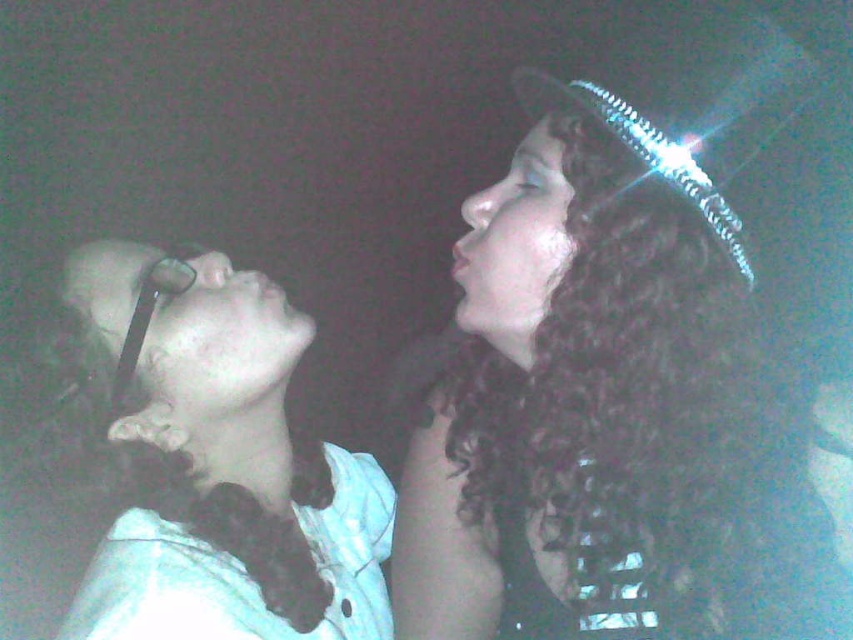
From the picture: Which of these two, curly hair at upper right or white lace collar at upper left, stands shorter?

With less height is white lace collar at upper left.

Who is positioned more to the left, curly hair at upper right or white lace collar at upper left?

white lace collar at upper left

Is point (538, 522) behind point (276, 403)?

No, it is in front of (276, 403).

Where is `curly hair at upper right`? The height and width of the screenshot is (640, 853). curly hair at upper right is located at coordinates (601, 390).